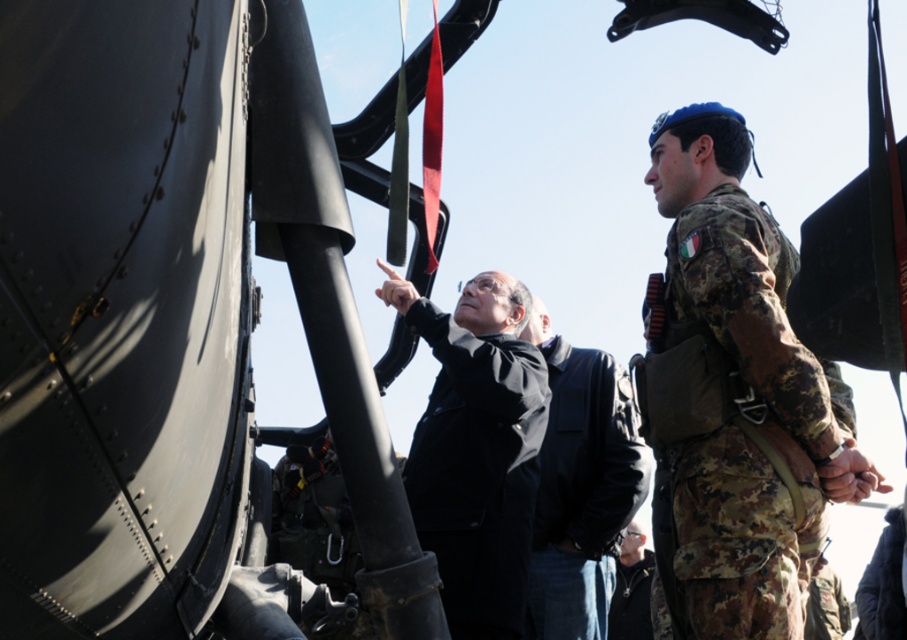
You are a photographer trying to capture a clear shot of the black leather jacket at center and the shiny black sunglasses at center. Since you want both items in focus, which one should you adjust your camera focus to prioritize first?

The black leather jacket at center is closer to the viewer than the shiny black sunglasses at center. To ensure both are in focus, prioritize focusing on the black leather jacket at center first, as it is closer, and the depth of field may naturally include the sunglasses if they are within the same plane.

In the scene described, there are two individuals wearing different clothing items. The first is wearing a camo fabric uniform at right, and the second has a black leather jacket at center. From the perspective of someone standing in front of the scene, which clothing item is positioned to the left?

The black leather jacket at center is to the left of the camo fabric uniform at right, so the black leather jacket at center is positioned to the left.

You are trying to determine if the black leather jacket at center can completely cover the shiny black sunglasses at center when placed over it. Based on their sizes, is this possible?

The black leather jacket at center might be wider than shiny black sunglasses at center, so it is possible that the jacket could cover the sunglasses if positioned correctly.